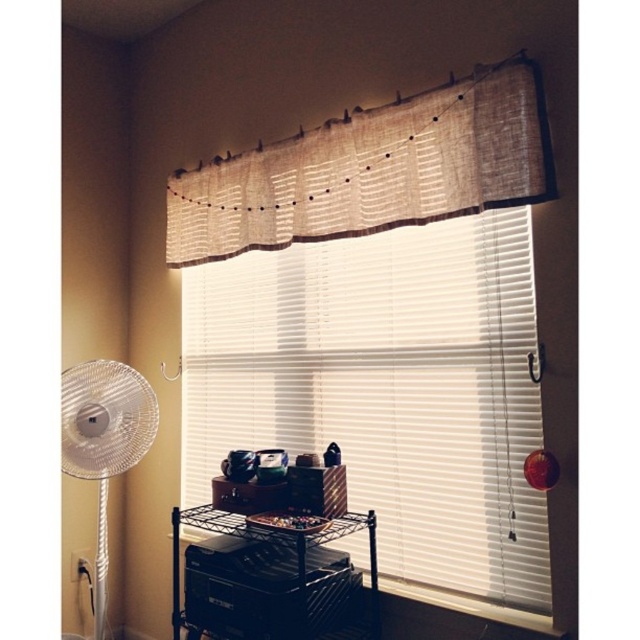
You are a delivery person who needs to place a camera on the metal shelving unit. The camera requires a space of at least 6 feet away from the white blinds at center to avoid glare. Can you place the camera on the middle shelf where the printer is located?

The white blinds at center and camera are 5.82 feet apart from each other, so placing the camera on the middle shelf where the printer is located would not meet the requirement since it is less than 6 feet away from the white blinds at center.

You are standing in the room and want to adjust the burlap curtain at upper center above the white blinds at center. Can you reach it without moving any furniture?

The burlap curtain at upper center is behind the white blinds at center, so you can reach it by moving the white blinds at center out of the way first.